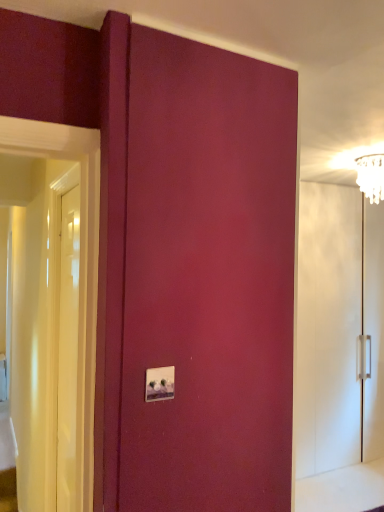
I want to click on white glossy light switch at center, so click(160, 384).

Find the location of `clear glass chandelier at upper right`. clear glass chandelier at upper right is located at coordinates (371, 176).

In order to click on white glossy door at left in this screenshot , I will do `click(68, 349)`.

Find the location of `white glossy light switch at center`. white glossy light switch at center is located at coordinates pos(160,384).

In the scene shown: From a real-world perspective, is white glossy door at left positioned above or below clear glass chandelier at upper right?

white glossy door at left is situated lower than clear glass chandelier at upper right in the real world.

Is white glossy door at left wider or thinner than clear glass chandelier at upper right?

Considering their sizes, white glossy door at left looks slimmer than clear glass chandelier at upper right.

This screenshot has height=512, width=384. What are the coordinates of `door on the left of clear glass chandelier at upper right` in the screenshot? It's located at 68,349.

How many degrees apart are the facing directions of white glossy door at left and clear glass chandelier at upper right?

They differ by 93.4 degrees in their facing directions.

Looking at this image, from their relative heights in the image, would you say white glossy cabinet at right is taller or shorter than clear glass chandelier at upper right?

Considering their sizes, white glossy cabinet at right has more height than clear glass chandelier at upper right.

Is white glossy cabinet at right situated inside clear glass chandelier at upper right or outside?

The correct answer is: outside.

Considering the relative positions of white glossy cabinet at right and clear glass chandelier at upper right in the image provided, is white glossy cabinet at right to the left of clear glass chandelier at upper right from the viewer's perspective?

No.

Considering the relative positions of white glossy cabinet at right and clear glass chandelier at upper right in the image provided, is white glossy cabinet at right behind clear glass chandelier at upper right?

Yes, white glossy cabinet at right is further from the camera.

From a real-world perspective, is white glossy door at left positioned above or below white glossy cabinet at right?

Clearly, from a real-world perspective, white glossy door at left is above white glossy cabinet at right.

Between white glossy door at left and white glossy cabinet at right, which one has larger size?

With larger size is white glossy cabinet at right.

Considering the positions of objects white glossy door at left and white glossy cabinet at right in the image provided, who is more to the left, white glossy door at left or white glossy cabinet at right?

white glossy door at left.

Locate an element on the screen. The height and width of the screenshot is (512, 384). light switch located above the white glossy cabinet at right (from a real-world perspective) is located at coordinates (160, 384).

Can you see white glossy cabinet at right touching white glossy light switch at center?

No, white glossy cabinet at right is not beside white glossy light switch at center.

Which object is further away from the camera taking this photo, white glossy cabinet at right or white glossy light switch at center?

white glossy cabinet at right.

Is the position of white glossy light switch at center less distant than that of white glossy cabinet at right?

Yes.

How many degrees apart are the facing directions of white glossy light switch at center and white glossy cabinet at right?

The facing directions of white glossy light switch at center and white glossy cabinet at right are 1.27 degrees apart.

Is point (168, 369) positioned behind point (345, 405)?

No.

Would you say white glossy cabinet at right is part of white glossy light switch at center's contents?

No, white glossy cabinet at right is not inside white glossy light switch at center.

Who is bigger, white glossy door at left or white glossy light switch at center?

With larger size is white glossy door at left.

From the image's perspective, who appears lower, white glossy door at left or white glossy light switch at center?

white glossy door at left.

Choose the correct answer: Is white glossy door at left inside white glossy light switch at center or outside it?

The correct answer is: outside.

Is clear glass chandelier at upper right aimed at white glossy light switch at center?

No, clear glass chandelier at upper right is not turned towards white glossy light switch at center.

From the image's perspective, is clear glass chandelier at upper right on white glossy light switch at center?

Correct, clear glass chandelier at upper right appears higher than white glossy light switch at center in the image.

Where is `light switch below the clear glass chandelier at upper right (from a real-world perspective)`? The width and height of the screenshot is (384, 512). light switch below the clear glass chandelier at upper right (from a real-world perspective) is located at coordinates (160, 384).

From a real-world perspective, does clear glass chandelier at upper right sit lower than white glossy light switch at center?

Actually, clear glass chandelier at upper right is physically above white glossy light switch at center in the real world.

Where is `door lying in front of the clear glass chandelier at upper right`? door lying in front of the clear glass chandelier at upper right is located at coordinates (68, 349).

This screenshot has height=512, width=384. Identify the location of light fixture above the white glossy cabinet at right (from the image's perspective). (371, 176).

Based on the photo, from the image, which object appears to be nearer to clear glass chandelier at upper right, white glossy door at left or white glossy cabinet at right?

Among the two, white glossy cabinet at right is located nearer to clear glass chandelier at upper right.

Consider the image. Based on their spatial positions, is white glossy light switch at center or white glossy door at left further from clear glass chandelier at upper right?

Among the two, white glossy light switch at center is located further to clear glass chandelier at upper right.

From the image, which object appears to be farther from white glossy light switch at center, white glossy cabinet at right or clear glass chandelier at upper right?

white glossy cabinet at right lies further to white glossy light switch at center than the other object.

From the picture: Considering their positions, is white glossy light switch at center positioned further to white glossy cabinet at right than clear glass chandelier at upper right?

white glossy light switch at center is positioned further to the anchor white glossy cabinet at right.

Estimate the real-world distances between objects in this image. Which object is closer to white glossy light switch at center, white glossy door at left or clear glass chandelier at upper right?

white glossy door at left.

When comparing their distances from white glossy door at left, does white glossy cabinet at right or clear glass chandelier at upper right seem further?

white glossy cabinet at right lies further to white glossy door at left than the other object.

Looking at the image, which one is located closer to white glossy door at left, white glossy light switch at center or white glossy cabinet at right?

The object closer to white glossy door at left is white glossy light switch at center.

When comparing their distances from white glossy cabinet at right, does white glossy light switch at center or white glossy door at left seem further?

white glossy light switch at center is positioned further to the anchor white glossy cabinet at right.

Where is `door located between white glossy light switch at center and white glossy cabinet at right in the depth direction`? Image resolution: width=384 pixels, height=512 pixels. door located between white glossy light switch at center and white glossy cabinet at right in the depth direction is located at coordinates (68, 349).

Find the location of a particular element. Image resolution: width=384 pixels, height=512 pixels. light fixture between white glossy door at left and white glossy cabinet at right is located at coordinates point(371,176).

What are the coordinates of `light switch between white glossy door at left and clear glass chandelier at upper right in the horizontal direction` in the screenshot? It's located at (160, 384).

I want to click on light fixture between white glossy light switch at center and white glossy cabinet at right in the front-back direction, so click(371, 176).